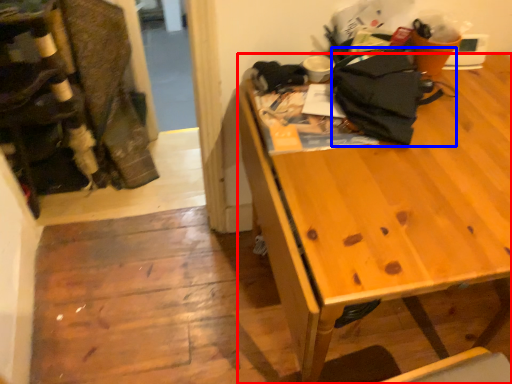
Question: Which object is further to the camera taking this photo, desk (highlighted by a red box) or clothing (highlighted by a blue box)?

Choices:
 (A) desk
 (B) clothing

Answer: (B)